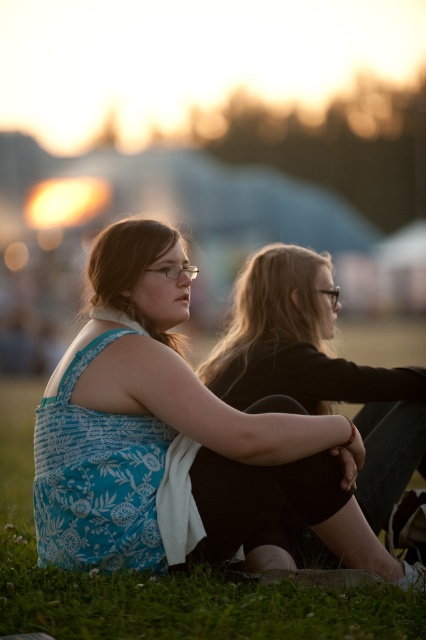
Question: Among these objects, which one is nearest to the camera?

Choices:
 (A) green grass at lower center
 (B) matte black hair at center

Answer: (A)

Question: Considering the relative positions of green grass at lower center and matte black hair at center in the image provided, where is green grass at lower center located with respect to matte black hair at center?

Choices:
 (A) left
 (B) right

Answer: (A)

Question: Among these points, which one is farthest from the camera?

Choices:
 (A) (0, 568)
 (B) (241, 384)

Answer: (B)

Question: Is green grass at lower center below matte black hair at center?

Choices:
 (A) yes
 (B) no

Answer: (A)

Question: Where is green grass at lower center located in relation to matte black hair at center in the image?

Choices:
 (A) below
 (B) above

Answer: (A)